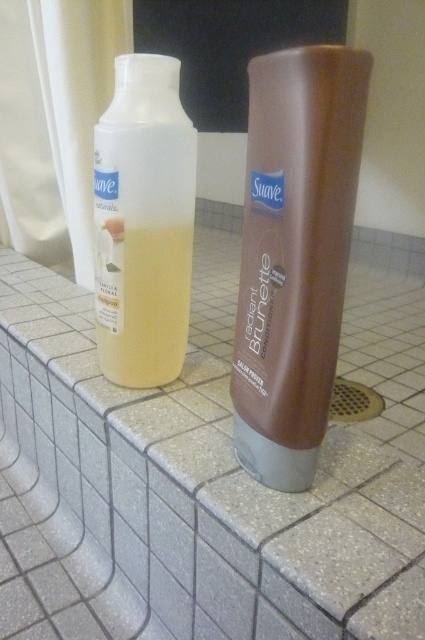
Question: Among these objects, which one is nearest to the camera?

Choices:
 (A) brown matte shampoo at center
 (B) translucent plastic shampoo at left

Answer: (A)

Question: Among these points, which one is farthest from the camera?

Choices:
 (A) (295, 534)
 (B) (147, 348)
 (C) (294, 312)

Answer: (B)

Question: Can you confirm if gray speckled tile at center is smaller than translucent plastic shampoo at left?

Choices:
 (A) no
 (B) yes

Answer: (A)

Question: Where is brown matte shampoo at center located in relation to translucent plastic shampoo at left in the image?

Choices:
 (A) right
 (B) left

Answer: (A)

Question: Which object appears farthest from the camera in this image?

Choices:
 (A) brown matte shampoo at center
 (B) gray speckled tile at center

Answer: (A)

Question: Is brown matte shampoo at center behind translucent plastic shampoo at left?

Choices:
 (A) no
 (B) yes

Answer: (A)